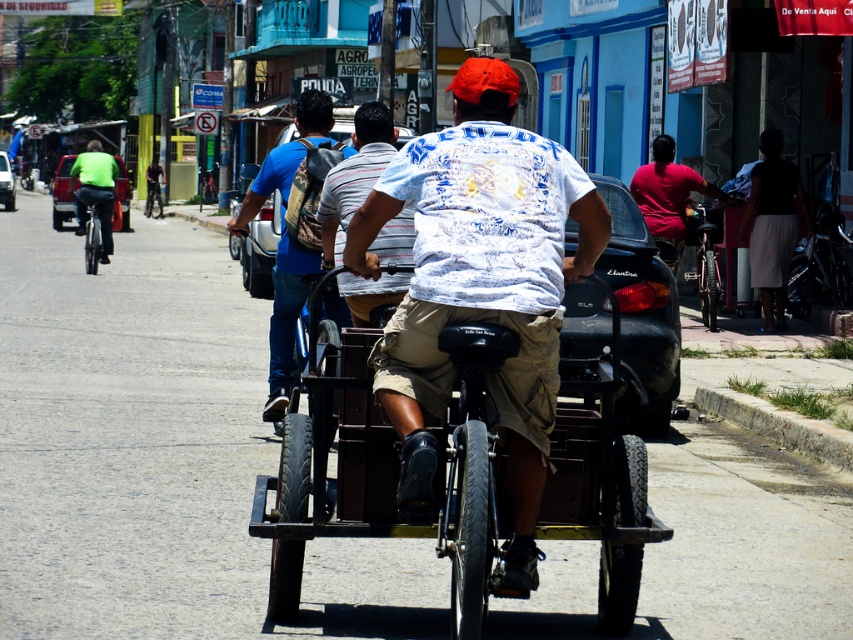
Who is taller, shiny metallic bicycle at right or metallic silver bicycle at center?

metallic silver bicycle at center

Between point (715, 205) and point (158, 211), which one is positioned behind?

The point (158, 211) is more distant.

Is point (704, 205) positioned in front of point (154, 216)?

Yes, it is.

You are a GUI agent. You are given a task and a screenshot of the screen. Output one action in this format:
    pyautogui.click(x=<x>, y=<y>)
    Task: Click on the shiny metallic bicycle at right
    This screenshot has height=640, width=853.
    Given the screenshot: What is the action you would take?
    pyautogui.click(x=705, y=259)

Who is higher up, white printed shirt at center or shiny silver bicycle at left?

shiny silver bicycle at left is higher up.

Does white printed shirt at center lie in front of shiny silver bicycle at left?

That is True.

Is point (402, 218) closer to viewer compared to point (108, 228)?

Yes, it is in front of point (108, 228).

Identify the location of white printed shirt at center. (354, 176).

Can you confirm if blue denim jeans at center is wider than white printed shirt at center?

Yes, blue denim jeans at center is wider than white printed shirt at center.

Can you confirm if blue denim jeans at center is thinner than white printed shirt at center?

In fact, blue denim jeans at center might be wider than white printed shirt at center.

Between point (296, 163) and point (369, 300), which one is positioned in front?

Point (369, 300)

Locate an element on the screen. This screenshot has height=640, width=853. blue denim jeans at center is located at coordinates (285, 316).